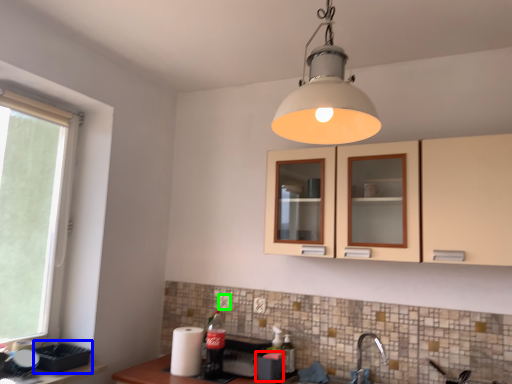
Question: Estimate the real-world distances between objects in this image. Which object is closer to appliance (highlighted by a red box), appliance (highlighted by a blue box) or electric outlet (highlighted by a green box)?

Choices:
 (A) appliance
 (B) electric outlet

Answer: (B)